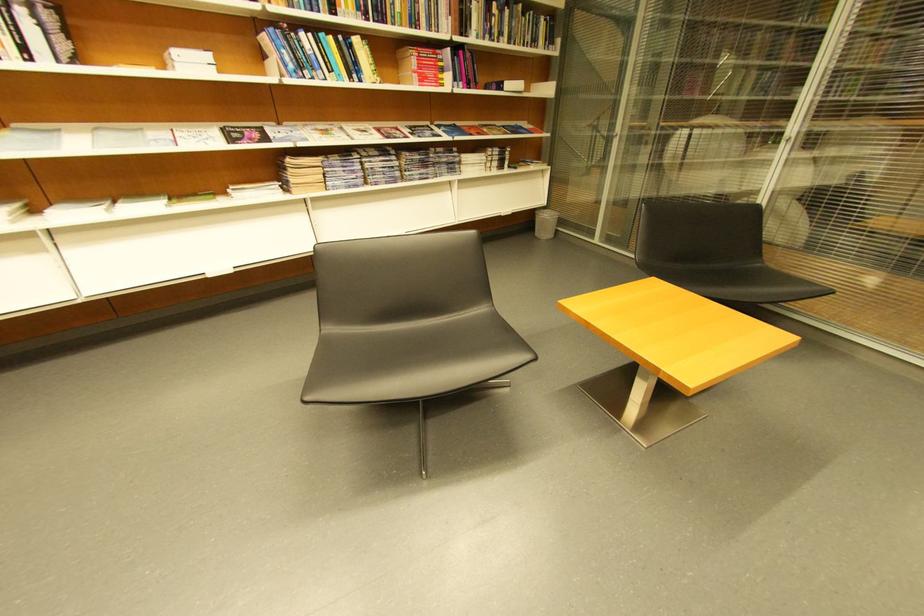
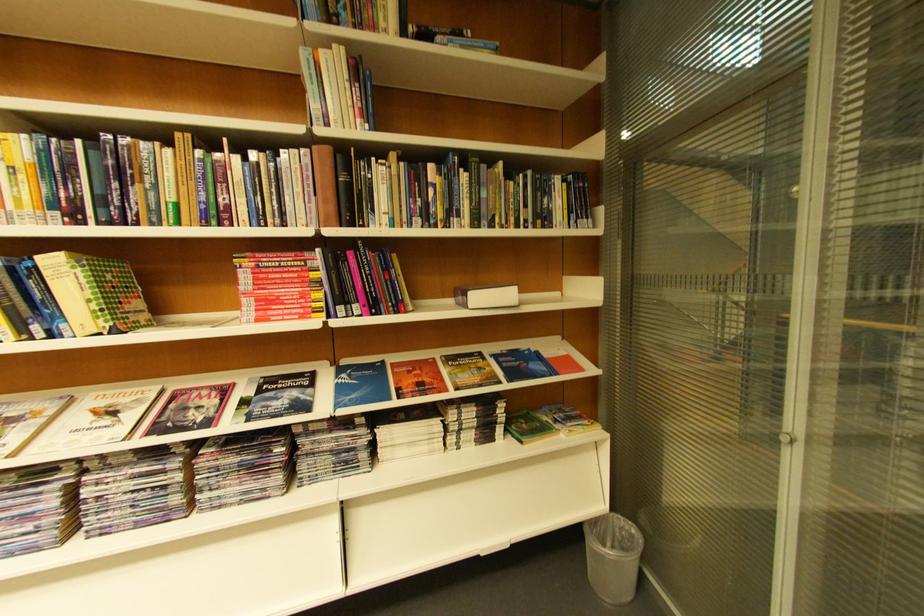
In the second image, find the point that corresponds to point (367, 43) in the first image.

(63, 264)